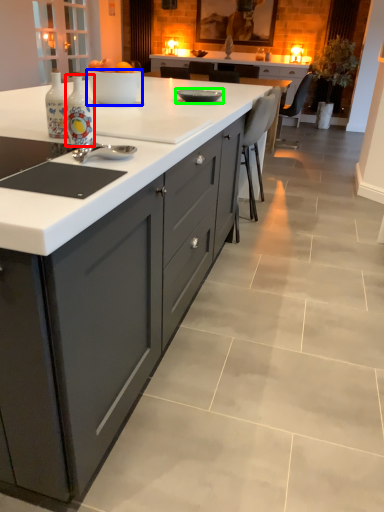
Question: Considering the real-world distances, which object is farthest from bottle (highlighted by a red box)? bowl (highlighted by a blue box) or kitchen appliance (highlighted by a green box)?

Choices:
 (A) bowl
 (B) kitchen appliance

Answer: (B)